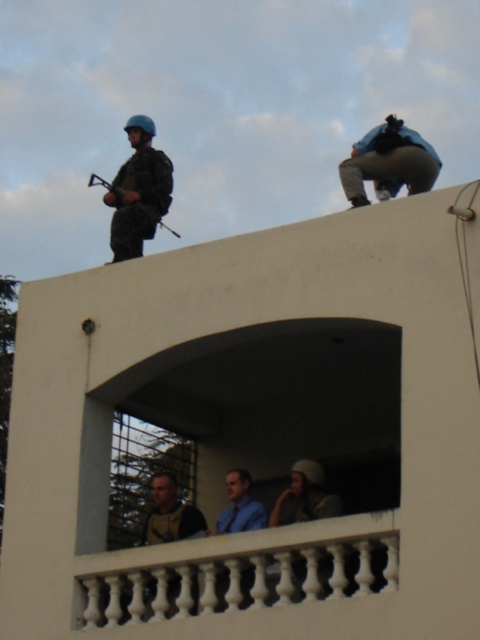
Is white concrete balcony at upper center positioned before blue fabric camera at upper center?

That is True.

Does point (462, 308) come farther from viewer compared to point (433, 148)?

That is False.

Where is `white concrete balcony at upper center`? This screenshot has height=640, width=480. white concrete balcony at upper center is located at coordinates (260, 429).

Is blue fabric camera at upper center shorter than metallic gun at upper left?

Incorrect, blue fabric camera at upper center's height does not fall short of metallic gun at upper left's.

From the picture: Can you confirm if blue fabric camera at upper center is thinner than metallic gun at upper left?

No, blue fabric camera at upper center is not thinner than metallic gun at upper left.

Locate an element on the screen. The height and width of the screenshot is (640, 480). blue fabric camera at upper center is located at coordinates (388, 163).

Is point (271, 387) more distant than point (130, 182)?

No, it is in front of (130, 182).

Between white concrete balcony at upper center and matte black helmet at upper left, which one is positioned lower?

white concrete balcony at upper center

Between point (66, 592) and point (159, 211), which one is positioned behind?

The point (159, 211) is more distant.

Locate an element on the screen. The width and height of the screenshot is (480, 640). white concrete balcony at upper center is located at coordinates (260, 429).